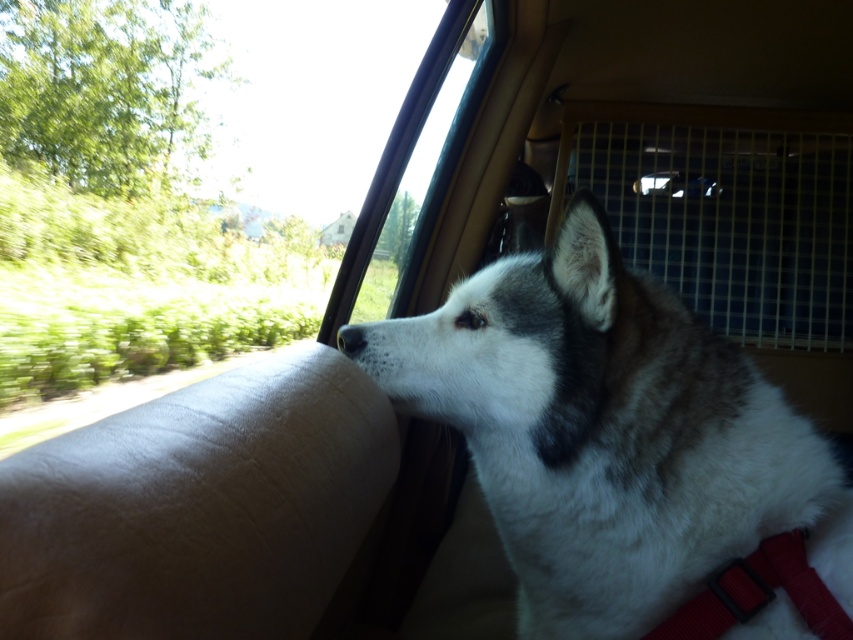
How far apart are transparent glass window at upper center and white fur at center?

transparent glass window at upper center and white fur at center are 11.06 meters apart from each other.

Does transparent glass window at upper center have a greater height compared to white fur at center?

Indeed, transparent glass window at upper center has a greater height compared to white fur at center.

Locate an element on the screen. transparent glass window at upper center is located at coordinates (213, 208).

The width and height of the screenshot is (853, 640). I want to click on transparent glass window at upper center, so click(x=213, y=208).

Is white fur dog at center to the left of transparent glass window at upper center from the viewer's perspective?

In fact, white fur dog at center is to the right of transparent glass window at upper center.

Who is higher up, white fur dog at center or transparent glass window at upper center?

transparent glass window at upper center is higher up.

Who is more forward, (699, 474) or (355, 177)?

Positioned in front is point (699, 474).

Identify the location of white fur dog at center. The width and height of the screenshot is (853, 640). (611, 435).

Does point (630, 275) lie behind point (352, 355)?

No, (630, 275) is in front of (352, 355).

Can you confirm if white fur dog at center is smaller than white fur at center?

Actually, white fur dog at center might be larger than white fur at center.

This screenshot has width=853, height=640. Identify the location of white fur dog at center. (611, 435).